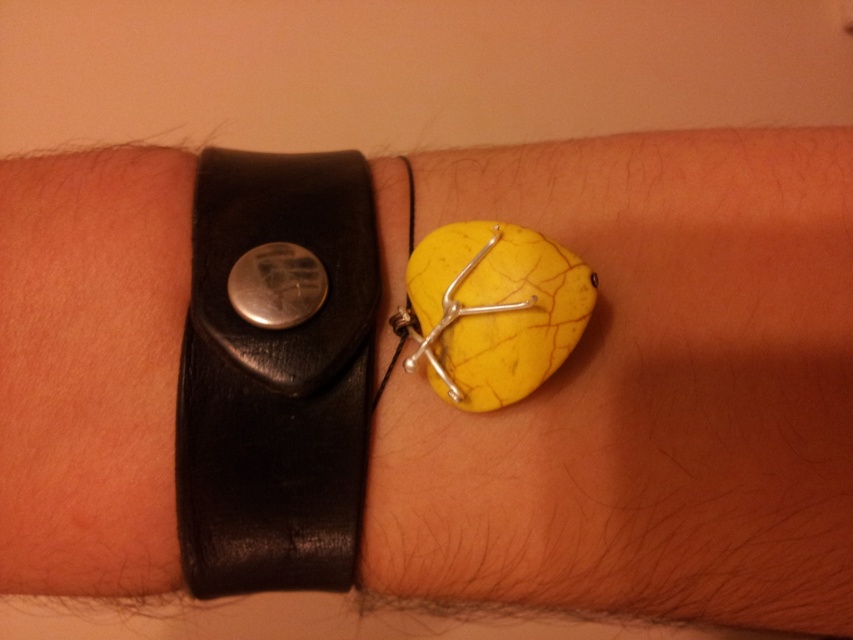
Question: Among these points, which one is farthest from the camera?

Choices:
 (A) (235, 540)
 (B) (448, 314)

Answer: (A)

Question: Which point appears closest to the camera in this image?

Choices:
 (A) (230, 429)
 (B) (457, 392)

Answer: (B)

Question: Does black leather watch at left have a lesser width compared to metallic yellow ring at center?

Choices:
 (A) yes
 (B) no

Answer: (B)

Question: Can you confirm if black leather watch at left is smaller than metallic yellow ring at center?

Choices:
 (A) yes
 (B) no

Answer: (B)

Question: Considering the relative positions of black leather watch at left and metallic yellow ring at center in the image provided, where is black leather watch at left located with respect to metallic yellow ring at center?

Choices:
 (A) below
 (B) above

Answer: (A)